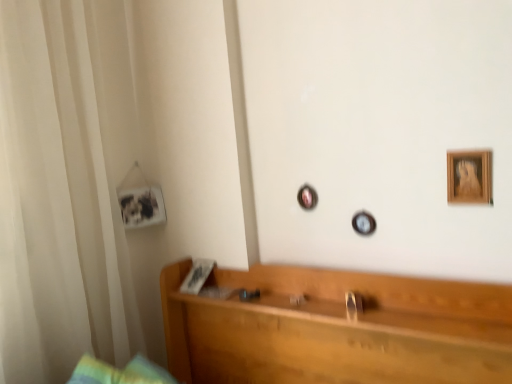
Question: Is white sheer curtain at left spatially inside wooden headboard at center, or outside of it?

Choices:
 (A) outside
 (B) inside

Answer: (A)

Question: Does point (83, 225) appear closer or farther from the camera than point (309, 342)?

Choices:
 (A) closer
 (B) farther

Answer: (B)

Question: Estimate the real-world distances between objects in this image. Which object is farther from the matte white photo frame at left, the 2th picture frame in the front-to-back sequence?

Choices:
 (A) white sheer curtain at left
 (B) wooden headboard at center
 (C) wooden picture frame at upper right, positioned as the 1th picture frame in right-to-left order

Answer: (C)

Question: Considering the real-world distances, which object is farthest from the white sheer curtain at left?

Choices:
 (A) matte white photo frame at left, the 2th picture frame in the front-to-back sequence
 (B) wooden headboard at center
 (C) wooden picture frame at upper right, the 2th picture frame in the back-to-front sequence

Answer: (C)